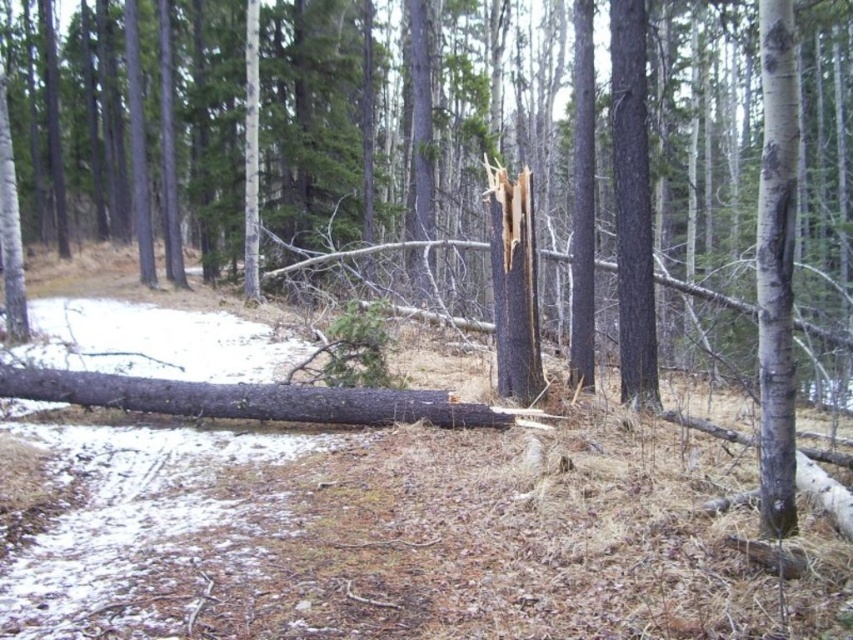
You are navigating through the forest and see two points marked on your map. The first point is at coordinates point (778, 260) and the second is at point (328, 417). Which point is closer to you if you are standing at the entrance of the forest?

Point (778, 260) is in front of point (328, 417), so the point closer to you would be point (778, 260).

You are a hiker in the forest and want to locate the white bark tree trunk at right. Based on the coordinates provided, where should you look relative to your current position?

The white bark tree trunk at right is located at coordinates point 0.420 on the x axis and 0.911 on the y axis, so you should look to the right and slightly downward from your current position.

You are a hiker trying to cross the forest floor. You see the white bark tree trunk at right and the dark gray bark log at center. Which object is higher up in the scene?

The white bark tree trunk at right is above the dark gray bark log at center, so it is higher up in the scene.